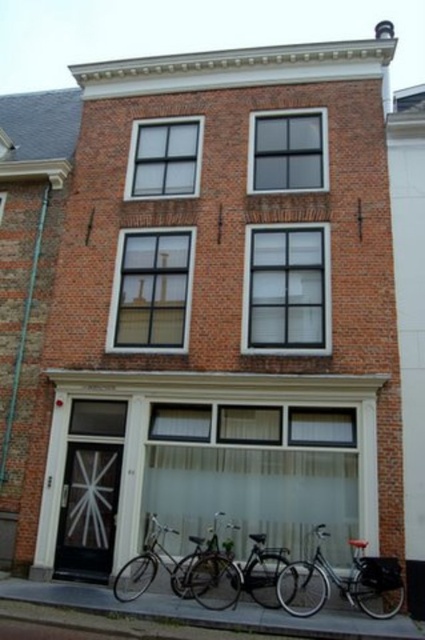
Locate an element on the screen. The width and height of the screenshot is (425, 640). matte glass door at lower left is located at coordinates (190, 401).

Between point (354, 388) and point (170, 560), which one is positioned in front?

Point (170, 560) is more forward.

This screenshot has width=425, height=640. What do you see at coordinates (190, 401) in the screenshot? I see `matte glass door at lower left` at bounding box center [190, 401].

The width and height of the screenshot is (425, 640). Find the location of `matte glass door at lower left`. matte glass door at lower left is located at coordinates (190, 401).

Between point (104, 522) and point (158, 548), which one is positioned in front?

Point (158, 548) is in front.

Is point (76, 538) positioned behind point (149, 545)?

Yes.

What do you see at coordinates (87, 512) in the screenshot?
I see `transparent glass door at lower left` at bounding box center [87, 512].

Locate an element on the screen. transparent glass door at lower left is located at coordinates (87, 512).

In the scene shown: Does matte glass door at lower left have a smaller size compared to shiny silver bicycle at lower right?

Yes.

Which of these two, matte glass door at lower left or shiny silver bicycle at lower right, stands taller?

Standing taller between the two is shiny silver bicycle at lower right.

Is point (56, 376) positioned in front of point (292, 572)?

No, (56, 376) is further to viewer.

This screenshot has height=640, width=425. I want to click on matte glass door at lower left, so click(x=190, y=401).